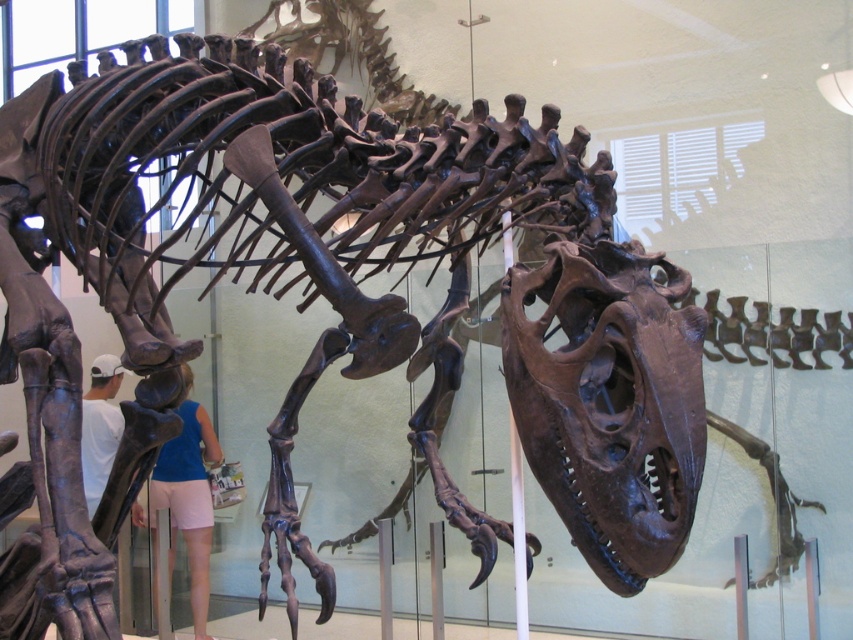
Does blue fabric shorts at lower center appear on the right side of white matte shirt at lower left?

Indeed, blue fabric shorts at lower center is positioned on the right side of white matte shirt at lower left.

From the picture: Who is positioned more to the right, blue fabric shorts at lower center or white matte shirt at lower left?

From the viewer's perspective, blue fabric shorts at lower center appears more on the right side.

Identify the location of blue fabric shorts at lower center. This screenshot has height=640, width=853. (189, 496).

This screenshot has height=640, width=853. What are the coordinates of `blue fabric shorts at lower center` in the screenshot? It's located at (189, 496).